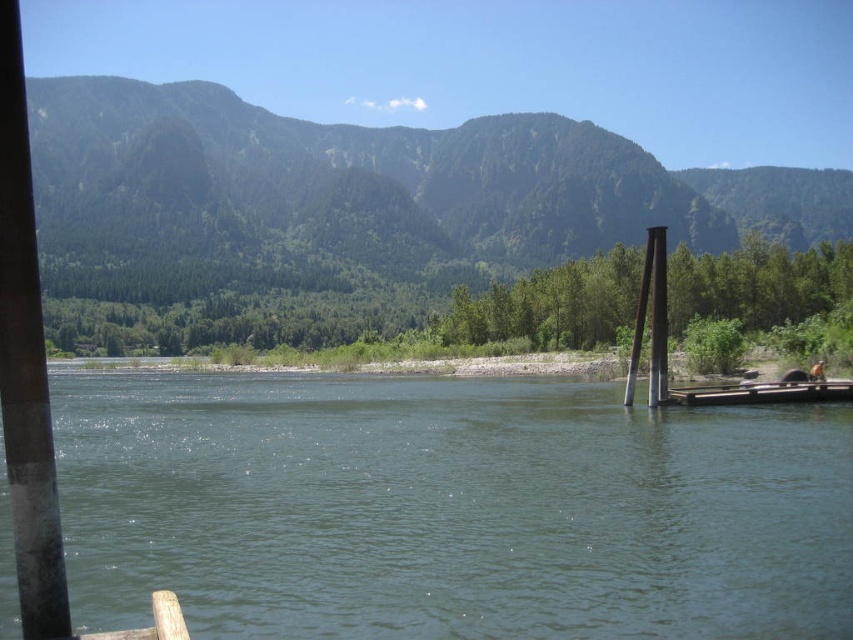
Question: Which object appears farthest from the camera in this image?

Choices:
 (A) brown wooden dock at right
 (B) greenish-blue water at center

Answer: (A)

Question: Which of the following is the closest to the observer?

Choices:
 (A) click(51, 93)
 (B) click(762, 381)

Answer: (B)

Question: Based on their relative distances, which object is farther from the green forested mountain at upper center?

Choices:
 (A) greenish-blue water at center
 (B) smooth gray pole at left
 (C) brown wooden dock at right

Answer: (B)

Question: Is green forested mountain at upper center wider than smooth gray pole at left?

Choices:
 (A) yes
 (B) no

Answer: (A)

Question: Observing the image, what is the correct spatial positioning of green forested mountain at upper center in reference to smooth gray pole at left?

Choices:
 (A) below
 (B) above

Answer: (B)

Question: Is green forested mountain at upper center to the right of smooth gray pole at left from the viewer's perspective?

Choices:
 (A) no
 (B) yes

Answer: (B)